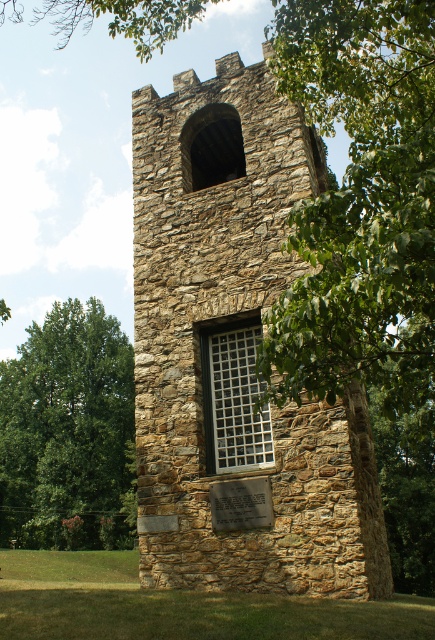
You are a visitor standing at the base of the stone tower. You notice the green leafy tree at left and the silver metallic plaque at lower center. Which object is positioned higher relative to the other?

The silver metallic plaque at lower center is positioned higher than the green leafy tree at left because the tree is located below it.

You are an architect assessing the structural integrity of the brown stone tower at center and the white grid glass at center. Which object has a greater width according to the measurements?

The brown stone tower at center has a greater width than the white grid glass at center.

You are an architect evaluating the stone tower. You notice the green leafy tree at left and the white grid glass at center. Which object would cast a larger shadow during midday?

The green leafy tree at left is larger in size than the white grid glass at center, so it would cast a larger shadow during midday.